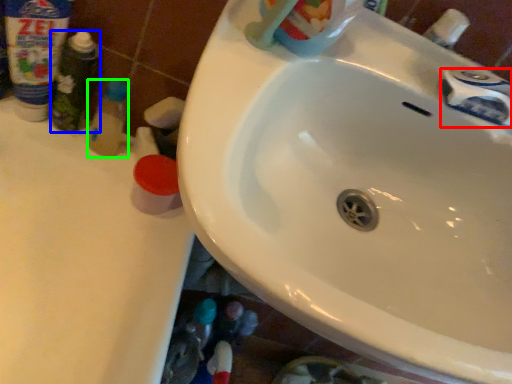
Question: Considering the real-world distances, which object is closest to plumbing fixture (highlighted by a red box)? toiletry (highlighted by a blue box) or toiletry (highlighted by a green box).

Choices:
 (A) toiletry
 (B) toiletry

Answer: (B)